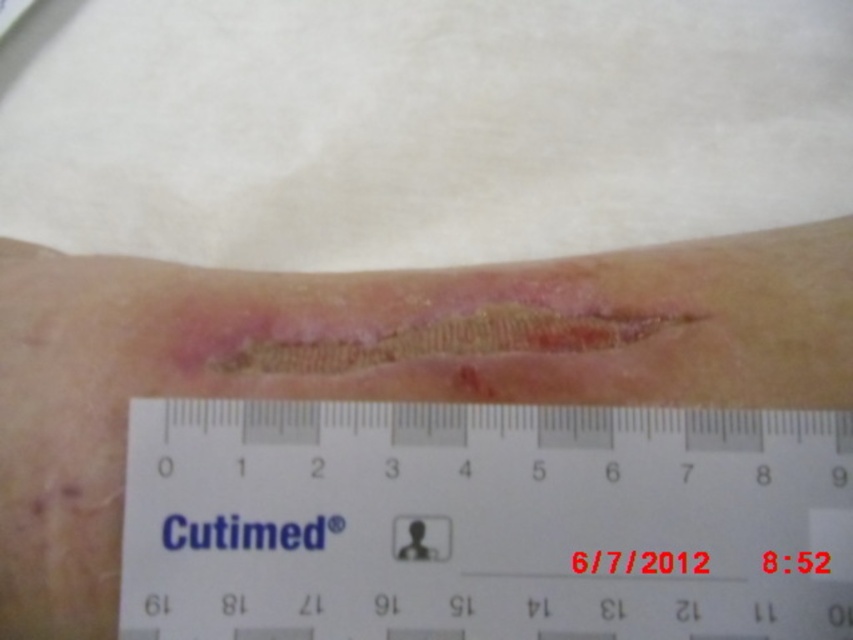
You are a nurse assessing a patient with a wound. You see the white paper ruler at center and the dry scabbed skin at center. Which object is positioned closer to your viewpoint?

The white paper ruler at center is closer to the viewer than the dry scabbed skin at center.

You are a nurse assessing a patient with a wound. You see the white paper ruler at center and the dry scabbed skin at center. Which object is shorter?

The white paper ruler at center is shorter than the dry scabbed skin at center.

You are a nurse assessing a patient with a wound on their forearm. You see a white paper ruler at center and a dry scabbed skin at center. Which object is smaller in size?

The white paper ruler at center is smaller in size compared to the dry scabbed skin at center.